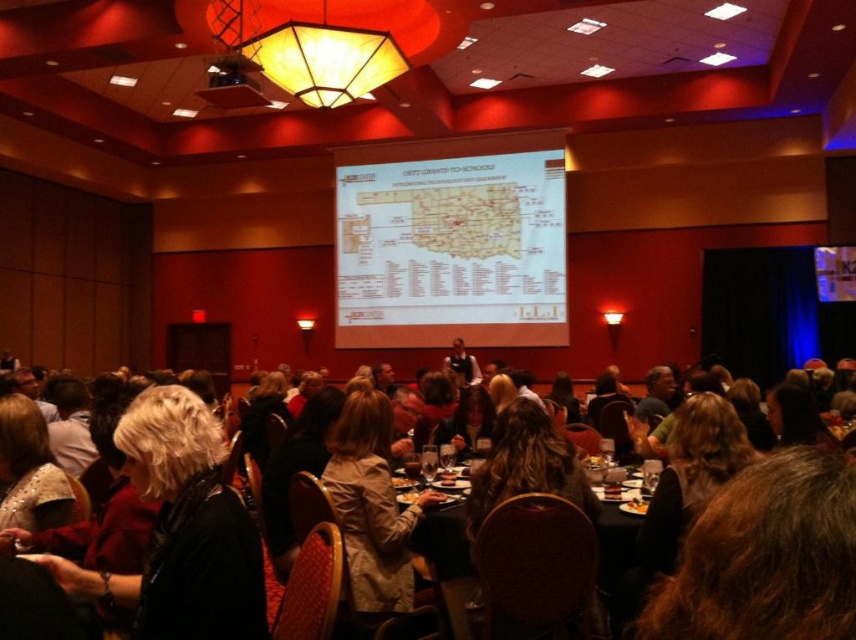
Is white paper map at center above light beige coat at center?

Indeed, white paper map at center is positioned over light beige coat at center.

Measure the distance between white paper map at center and light beige coat at center.

white paper map at center is 9.65 meters from light beige coat at center.

Is point (551, 184) positioned before point (324, 468)?

No, it is not.

Where is `white paper map at center`? This screenshot has height=640, width=856. white paper map at center is located at coordinates (450, 243).

Who is positioned more to the right, white paper map at center or black plastic table at center?

Positioned to the right is white paper map at center.

Between white paper map at center and black plastic table at center, which one is positioned higher?

white paper map at center is above.

You are a GUI agent. You are given a task and a screenshot of the screen. Output one action in this format:
    pyautogui.click(x=<x>, y=<y>)
    Task: Click on the white paper map at center
    
    Given the screenshot: What is the action you would take?
    pyautogui.click(x=450, y=243)

Who is taller, black plastic table at center or metallic projector at upper center?

→ black plastic table at center

Is point (607, 586) behind point (266, 104)?

No, (607, 586) is closer to viewer.

Is point (438, 570) closer to viewer compared to point (224, 70)?

That is True.

This screenshot has width=856, height=640. Identify the location of black plastic table at center. (447, 556).